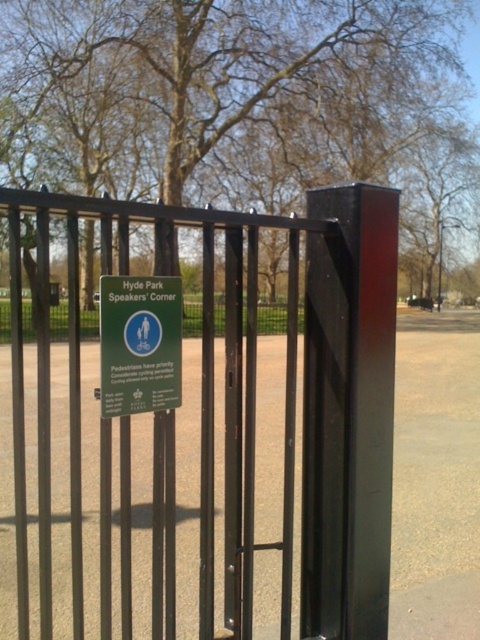
You are a park visitor trying to find the entrance to Hyde Park. You see the black metal fence at center and the green plastic sign at center. Which object is bigger?

The black metal fence at center is larger than the green plastic sign at center.

You are a park visitor who wants to see the sign attached to the fence. Since the fence is part of the park entrance, can you easily read the green plastic sign at center attached to the black metal fence at center without needing to climb or move the fence?

The black metal fence at center is much taller than the green plastic sign at center, so the sign is likely positioned lower on the fence and can be easily read without needing to climb or move the fence.